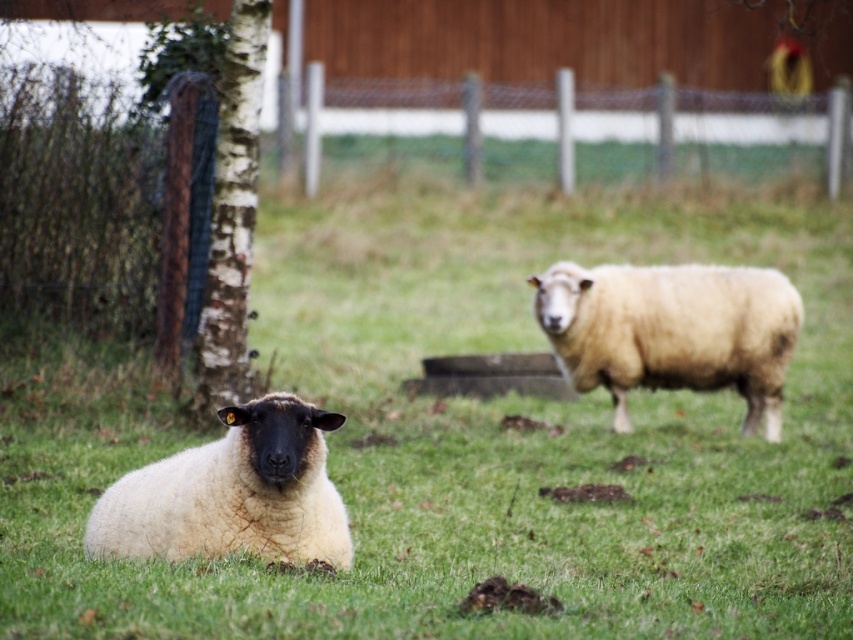
You are a photographer trying to capture the white woolly sheep at center in focus while the green grassy at center is blurred. Based on the scene description, can you adjust your camera settings to achieve this effect?

The green grassy at center is in front of the white woolly sheep at center, so to blur the foreground grass while keeping the sheep in focus, you should focus on the sheep and use a shallow depth of field. This will blur the closer grass while keeping the sheep sharp.

You are a photographer trying to capture the white woolly sheep at center in the image. The green grassy at center is blocking your view. Can you determine if the grass is taller than the sheep?

The green grassy at center is much taller than the white woolly sheep at center, so yes, the grass is blocking the view because it is taller than the sheep.